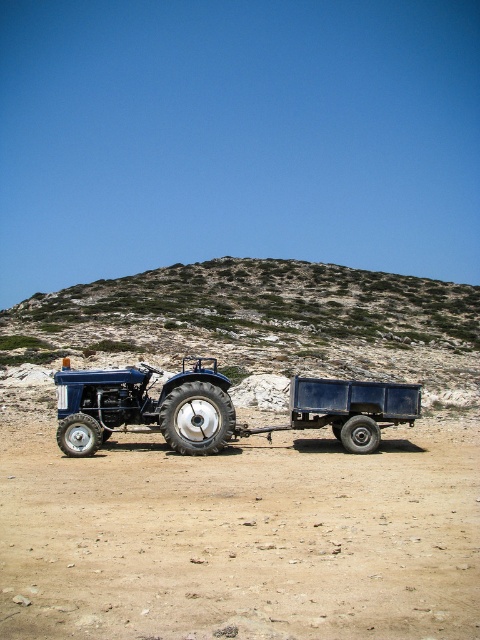
Between blue matte trailer truck at center and black rubber tire at center, which one has less height?

black rubber tire at center

Consider the image. Is blue matte trailer truck at center to the left of black rubber tire at center from the viewer's perspective?

Correct, you'll find blue matte trailer truck at center to the left of black rubber tire at center.

Locate an element on the screen. The width and height of the screenshot is (480, 640). blue matte trailer truck at center is located at coordinates (352, 408).

Does green rocky hillside at upper center appear on the left side of rubber/textured tire at lower left?

In fact, green rocky hillside at upper center is to the right of rubber/textured tire at lower left.

Does green rocky hillside at upper center come in front of rubber/textured tire at lower left?

No, green rocky hillside at upper center is further to the viewer.

Is point (406, 365) farther from camera compared to point (72, 426)?

Yes.

Image resolution: width=480 pixels, height=640 pixels. Find the location of `green rocky hillside at upper center`. green rocky hillside at upper center is located at coordinates (264, 324).

Who is lower down, green rocky hillside at upper center or metallic blue tractor at center?

metallic blue tractor at center

What do you see at coordinates (264, 324) in the screenshot? I see `green rocky hillside at upper center` at bounding box center [264, 324].

Does point (283, 337) come farther from viewer compared to point (205, 376)?

Yes, it is.

You are a GUI agent. You are given a task and a screenshot of the screen. Output one action in this format:
    pyautogui.click(x=<x>, y=<y>)
    Task: Click on the green rocky hillside at upper center
    
    Given the screenshot: What is the action you would take?
    pyautogui.click(x=264, y=324)